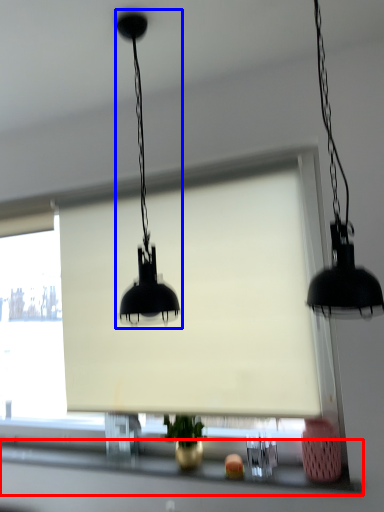
Question: Which object is closer to the camera taking this photo, window sill (highlighted by a red box) or lamp (highlighted by a blue box)?

Choices:
 (A) window sill
 (B) lamp

Answer: (B)